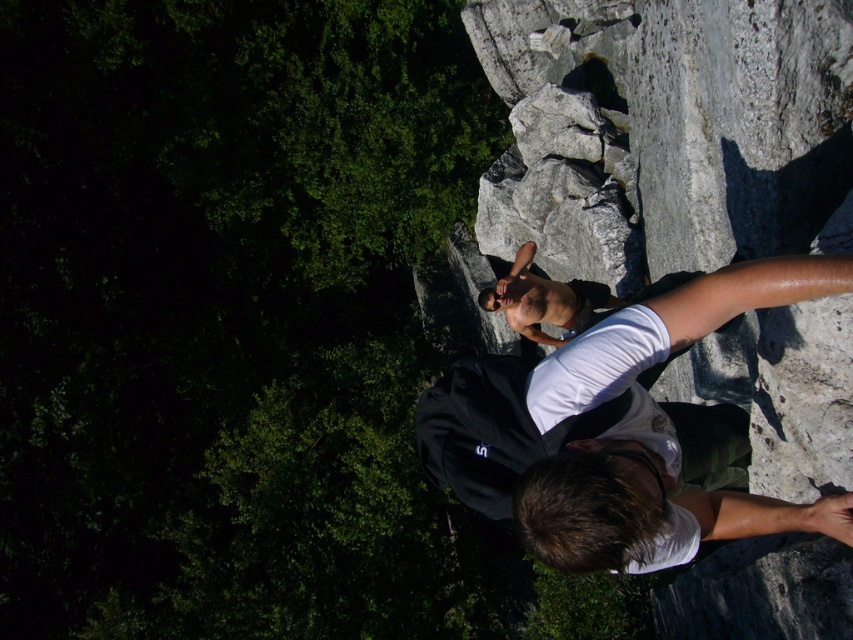
Does shiny black shirt at center have a larger size compared to shiny skin torso at center?

No, shiny black shirt at center is not bigger than shiny skin torso at center.

Is point (612, 344) behind point (485, 304)?

No, (612, 344) is in front of (485, 304).

The height and width of the screenshot is (640, 853). What do you see at coordinates (619, 433) in the screenshot?
I see `shiny black shirt at center` at bounding box center [619, 433].

Where is `shiny black shirt at center`? The width and height of the screenshot is (853, 640). shiny black shirt at center is located at coordinates (619, 433).